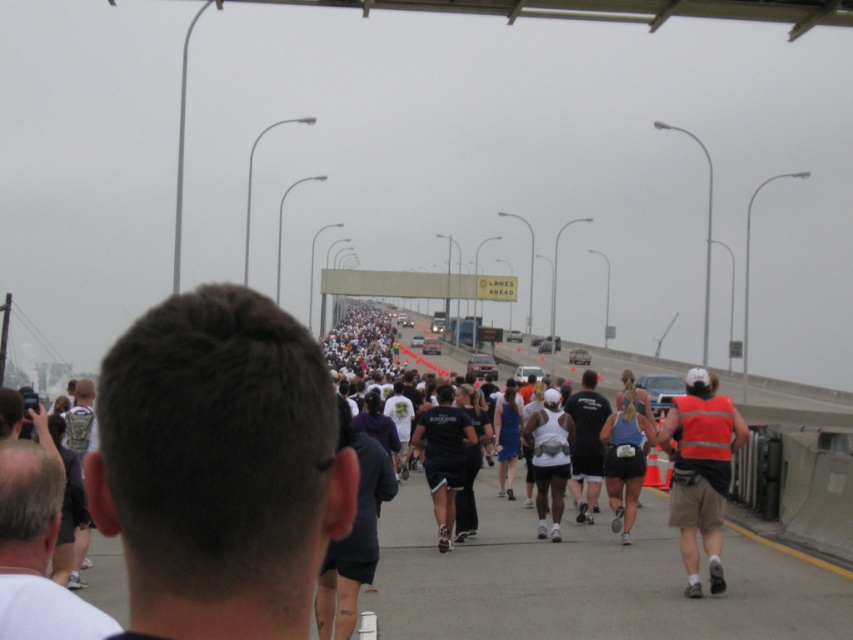
Question: Which point is closer to the camera taking this photo?

Choices:
 (A) (614, 483)
 (B) (444, 413)
 (C) (698, 456)
 (D) (115, 464)

Answer: (D)

Question: Which point appears closest to the camera in this image?

Choices:
 (A) (720, 428)
 (B) (440, 513)

Answer: (A)

Question: Which point is closer to the camera taking this photo?

Choices:
 (A) [x=695, y=385]
 (B) [x=433, y=483]
 (C) [x=546, y=484]

Answer: (A)

Question: Does reflective orange vest at right have a larger size compared to black fabric shirt at center?

Choices:
 (A) no
 (B) yes

Answer: (B)

Question: Does dark hair at center appear under reflective orange vest at right?

Choices:
 (A) yes
 (B) no

Answer: (B)

Question: Can you confirm if reflective orange vest at right is smaller than white matte tank top at center?

Choices:
 (A) no
 (B) yes

Answer: (A)